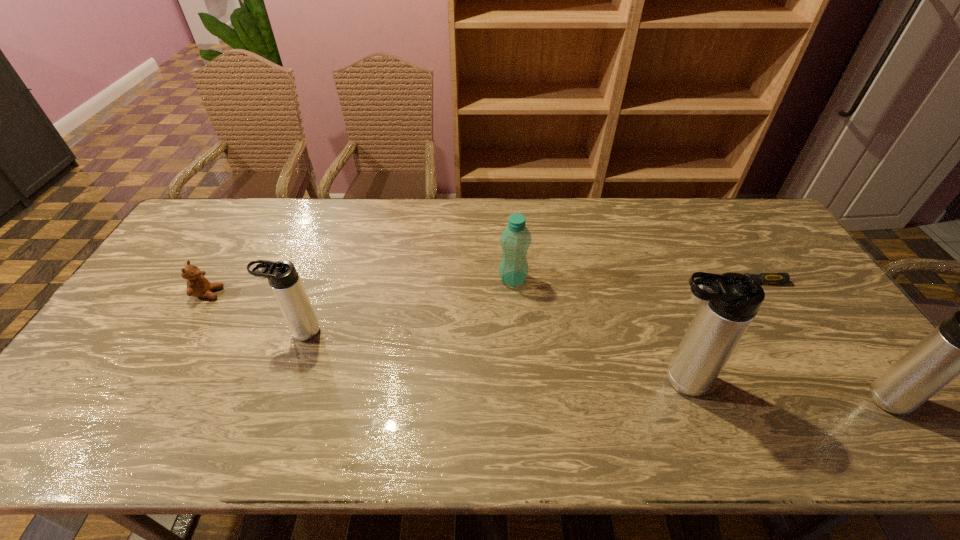
I want to click on vacant space that's between the third object from left to right and the leftmost object, so click(x=361, y=286).

Locate an element on the screen. unoccupied area between the leftmost thermos bottle and the rightmost thermos bottle is located at coordinates (597, 370).

Identify the location of free space between the third nearest object and the third object from right to left. The width and height of the screenshot is (960, 540). (489, 356).

Image resolution: width=960 pixels, height=540 pixels. What are the coordinates of `unoccupied area between the third nearest object and the fifth tallest object` in the screenshot? It's located at (254, 313).

Where is `unoccupied position between the second thermos bottle from right to left and the bottle`? unoccupied position between the second thermos bottle from right to left and the bottle is located at coordinates (595, 330).

The image size is (960, 540). I want to click on free space between the third object from right to left and the bottle, so click(x=595, y=330).

Where is `free spot between the screwdriver and the second shortest object`? Image resolution: width=960 pixels, height=540 pixels. free spot between the screwdriver and the second shortest object is located at coordinates (477, 288).

I want to click on object that is the fourth closest to the second thermos bottle from left to right, so click(x=283, y=278).

Select which object is the second closest to the second thermos bottle from left to right. Please provide its 2D coordinates. Your answer should be formatted as a tuple, i.e. [(x, y)], where the tuple contains the x and y coordinates of a point satisfying the conditions above.

[(959, 345)]

Locate which thermos bottle is the third closest to the leftmost object. Please provide its 2D coordinates. Your answer should be formatted as a tuple, i.e. [(x, y)], where the tuple contains the x and y coordinates of a point satisfying the conditions above.

[(959, 345)]